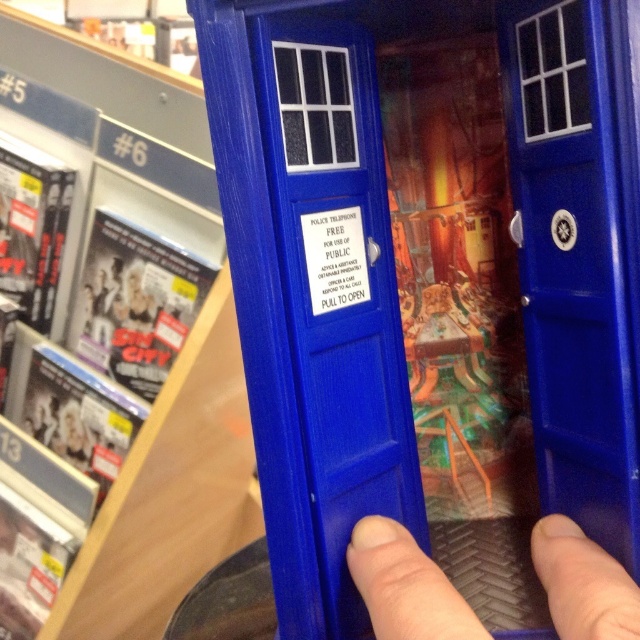
Consider the image. You are holding a TARDIS model and notice two blue plastic items inside it. The blue plastic bookshelf at center and the blue plastic finger at lower center. Which one is closer to the top of the TARDIS model?

The blue plastic bookshelf at center is located above the blue plastic finger at lower center, so it is closer to the top of the TARDIS model.